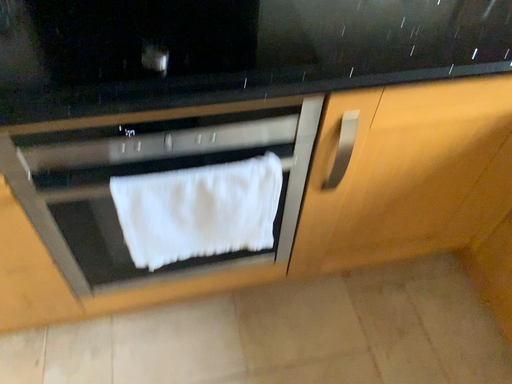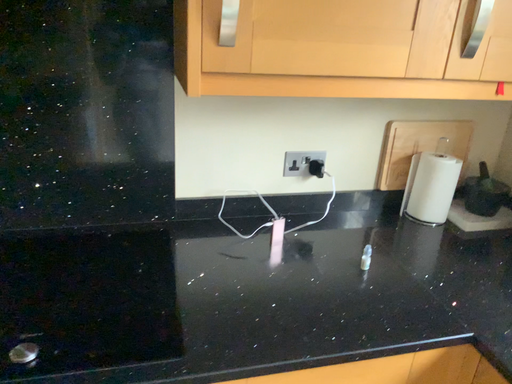
Question: How did the camera likely rotate when shooting the video?

Choices:
 (A) rotated upward
 (B) rotated downward

Answer: (A)